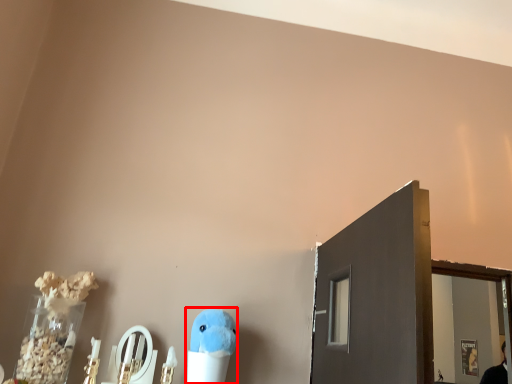
Question: Considering the relative positions of toy (annotated by the red box) and mirror in the image provided, where is toy (annotated by the red box) located with respect to the staircase?

Choices:
 (A) left
 (B) right

Answer: (B)